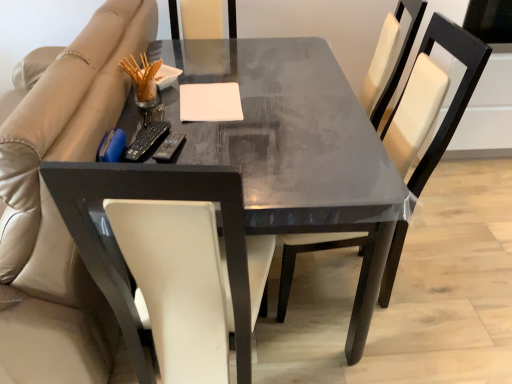
The image size is (512, 384). Find the location of `unoccupied area in front of white matte notepad at center`. unoccupied area in front of white matte notepad at center is located at coordinates (219, 137).